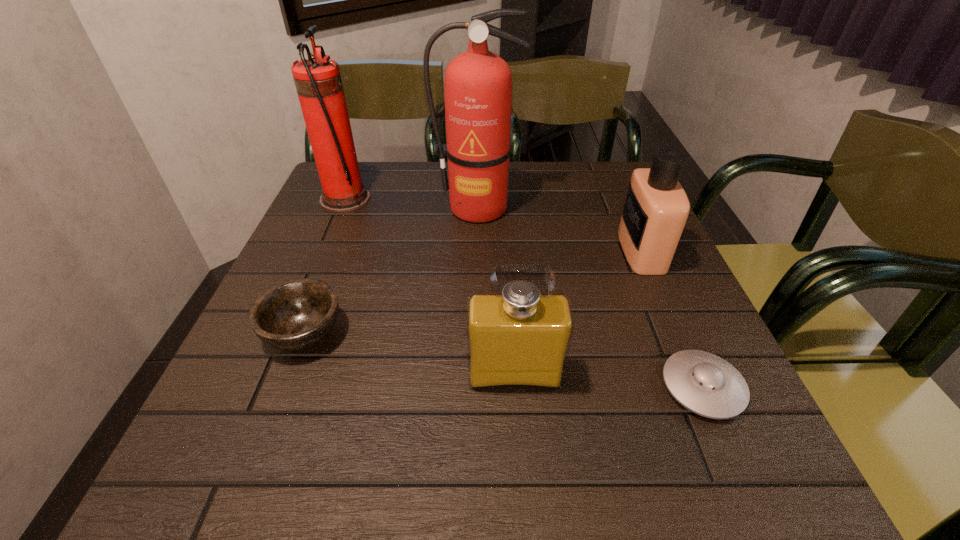
What are the coordinates of `vacant space located on the front label of the third farthest object` in the screenshot? It's located at (447, 251).

This screenshot has height=540, width=960. Find the location of `vacant region located on the front label of the third farthest object`. vacant region located on the front label of the third farthest object is located at coordinates (596, 251).

Locate an element on the screen. The image size is (960, 540). vacant space positioned on the front-facing side of the nearer perfume is located at coordinates (519, 444).

You are a GUI agent. You are given a task and a screenshot of the screen. Output one action in this format:
    pyautogui.click(x=<x>, y=<y>)
    Task: Click on the free space located on the back of the bowl
    The width and height of the screenshot is (960, 540).
    Given the screenshot: What is the action you would take?
    pyautogui.click(x=331, y=262)

This screenshot has width=960, height=540. What are the coordinates of `free space located 0.160m on the left of the saucer` in the screenshot? It's located at (567, 387).

What are the coordinates of `fire extinguisher present at the left edge` in the screenshot? It's located at (318, 82).

Find the location of a particular element. bowl that is positioned at the left edge is located at coordinates (297, 314).

Where is `perfume that is at the right edge`? This screenshot has width=960, height=540. perfume that is at the right edge is located at coordinates pyautogui.click(x=656, y=208).

Locate an element on the screen. The image size is (960, 540). saucer at the right edge is located at coordinates coord(704,383).

Find the location of a particular element. object located in the far left corner section of the desktop is located at coordinates (318, 82).